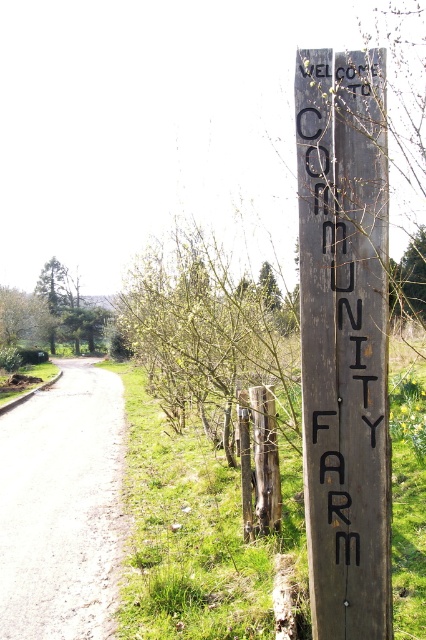
Question: Which object is closer to the camera taking this photo?

Choices:
 (A) wooden signboard at right
 (B) green grass at center

Answer: (A)

Question: Is green grass at center bigger than gravel path at center?

Choices:
 (A) no
 (B) yes

Answer: (B)

Question: Estimate the real-world distances between objects in this image. Which object is closer to the wooden signboard at right?

Choices:
 (A) gravel path at center
 (B) green grass at center

Answer: (B)

Question: In this image, where is green grass at center located relative to gravel path at center?

Choices:
 (A) above
 (B) below

Answer: (A)

Question: Does wooden signboard at right appear over green grass at center?

Choices:
 (A) yes
 (B) no

Answer: (A)

Question: Which of the following is the farthest from the observer?

Choices:
 (A) (282, 445)
 (B) (373, 628)

Answer: (A)